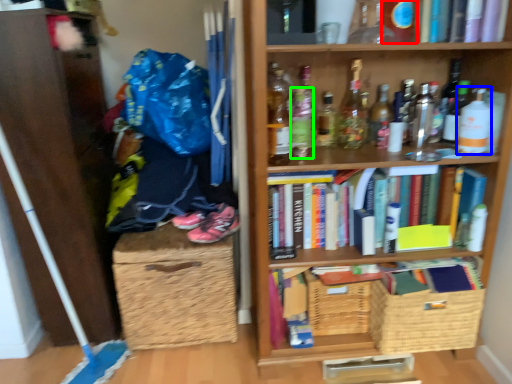
Question: Considering the real-world distances, which object is closest to bottle (highlighted by a red box)? bottle (highlighted by a blue box) or bottle (highlighted by a green box).

Choices:
 (A) bottle
 (B) bottle

Answer: (A)